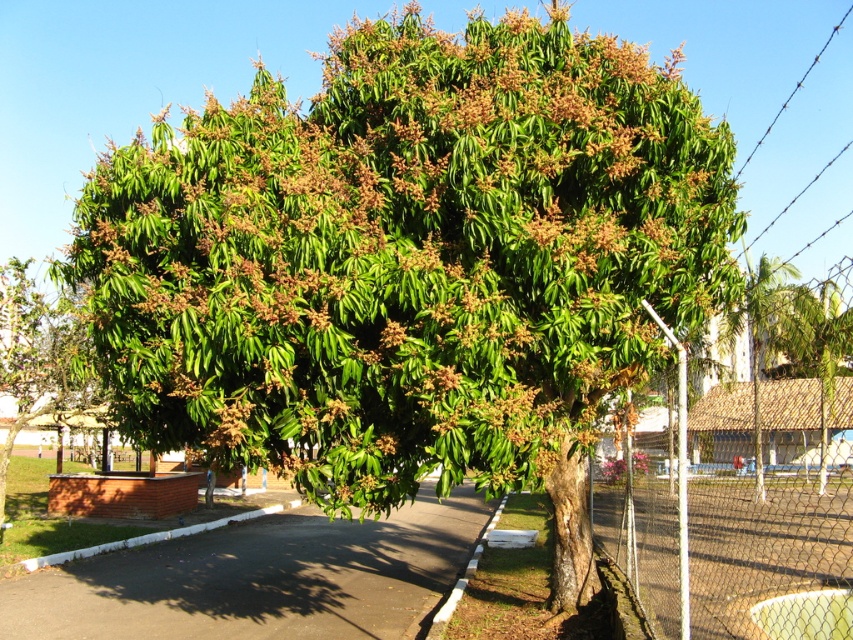
You are a landscape architect designing a new park. You need to place a 10 meter long bench between the wire mesh fence at right and the white painted concrete curb at lower center. Is there enough space?

The distance between the wire mesh fence at right and the white painted concrete curb at lower center is 8.85 meters. Since the bench is 10 meters long, it will not fit in the available space.

Consider the image. You are standing at the base of the large, lush mango tree and want to walk to the dark gray asphalt at center. According to the image, in which direction should you head relative to the tree?

The dark gray asphalt at center is located at point coordinates, so you should head towards the center area relative to the tree.

You are standing at the base of the large mango tree and want to walk to the white painted concrete curb at lower left. According to the image, in which direction should you head relative to the tree?

The white painted concrete curb at lower left is located at point (151, 538) in the image, so you should head towards the lower left direction relative to the tree.